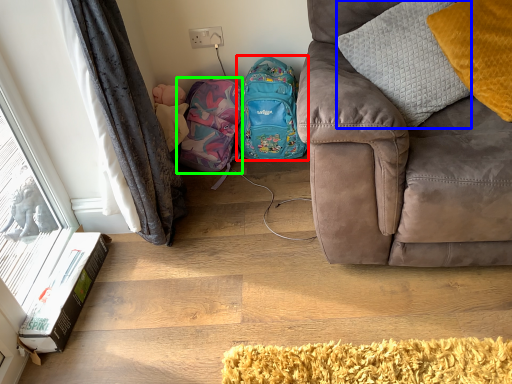
Question: Which object is positioned closest to backpack (highlighted by a red box)? Select from pillow (highlighted by a blue box) and bag (highlighted by a green box).

Choices:
 (A) pillow
 (B) bag

Answer: (B)